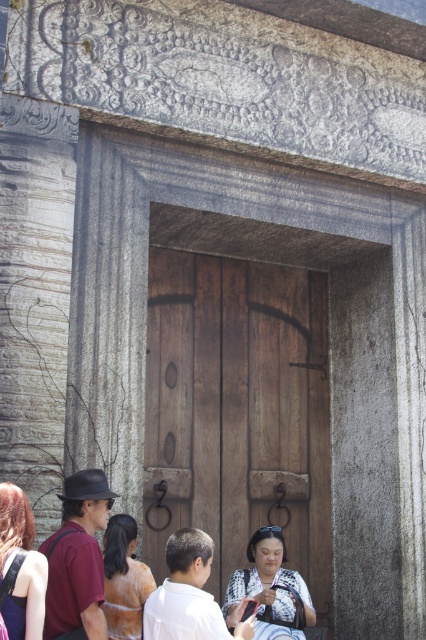
You are standing at the entrance of a historical building and see the brown wooden door at center and the matte black hair at lower left. You need to place a 20 feet long banner between them. Will the banner fit between them?

The distance between the brown wooden door at center and the matte black hair at lower left is 19.86 feet, which is slightly shorter than the 20 feet banner. Therefore, the banner will not fit between them as it is 0.14 feet too long.

You are standing in front of the scene described. You want to place a small potted plant between the brown wooden door at center and the matte black hair at lower left. Based on their positions, where should you place the plant?

The brown wooden door at center is above the matte black hair at lower left, so you should place the small potted plant between them in the lower middle area between the door and the hair.